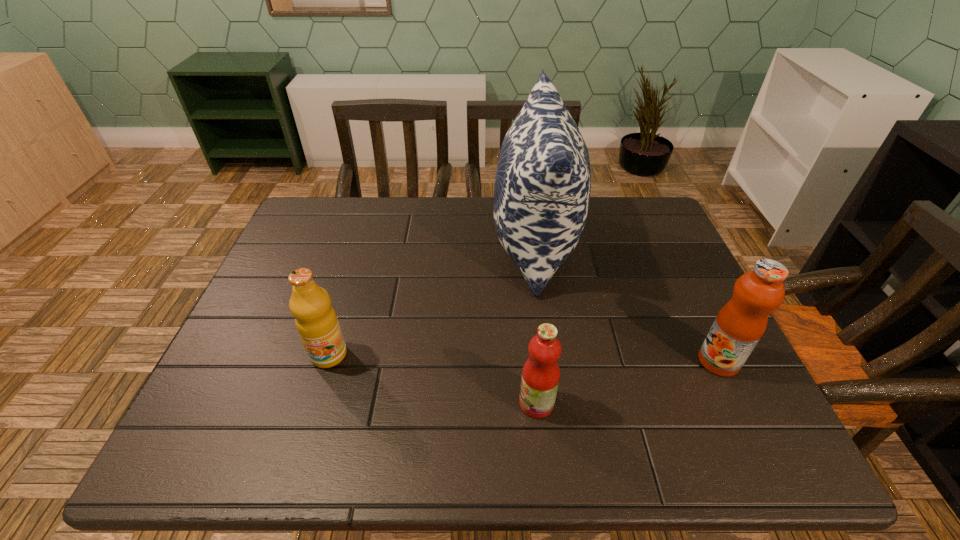
The width and height of the screenshot is (960, 540). Identify the location of the farthest object. (x=542, y=187).

Locate an element on the screen. the tallest object is located at coordinates (542, 187).

Identify the location of the rightmost object. (741, 322).

I want to click on the leftmost fruit juice, so click(x=316, y=321).

You are a GUI agent. You are given a task and a screenshot of the screen. Output one action in this format:
    pyautogui.click(x=<x>, y=<y>)
    Task: Click on the nearest fruit juice
    The image size is (960, 540).
    Given the screenshot: What is the action you would take?
    pyautogui.click(x=540, y=378)

The height and width of the screenshot is (540, 960). In order to click on the nearest object in this screenshot , I will do `click(540, 378)`.

Image resolution: width=960 pixels, height=540 pixels. What are the coordinates of `vacant space located on the front surface of the tallest object` in the screenshot? It's located at (377, 245).

What are the coordinates of `vacant area located 0.050m on the front surface of the tallest object` in the screenshot? It's located at (475, 245).

You are a GUI agent. You are given a task and a screenshot of the screen. Output one action in this format:
    pyautogui.click(x=<x>, y=<y>)
    Task: Click on the free spot located 0.270m on the front surface of the tallest object
    This screenshot has height=540, width=960.
    Given the screenshot: What is the action you would take?
    (398, 245)

Image resolution: width=960 pixels, height=540 pixels. I want to click on free space located on the front label of the rightmost object, so click(x=644, y=361).